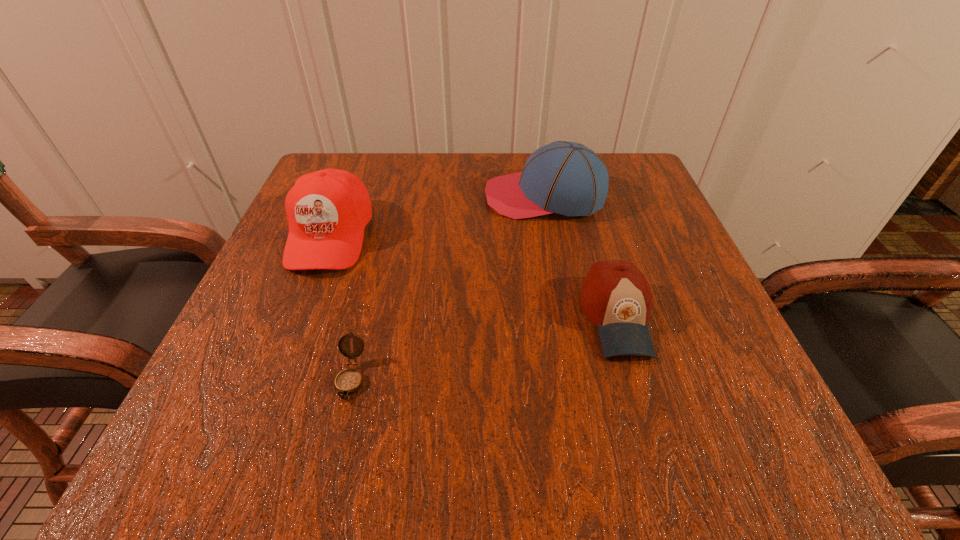
Where is `the leftmost baseball cap`? the leftmost baseball cap is located at coordinates (327, 210).

The width and height of the screenshot is (960, 540). What are the coordinates of `the third tallest object` in the screenshot? It's located at (615, 296).

Locate an element on the screen. The image size is (960, 540). the nearest baseball cap is located at coordinates (615, 296).

Find the location of a particular element. compass is located at coordinates (348, 381).

The width and height of the screenshot is (960, 540). In order to click on the third object from right to left in this screenshot , I will do `click(348, 381)`.

Where is `free space located 0.230m on the front panel of the leftmost object`? The image size is (960, 540). free space located 0.230m on the front panel of the leftmost object is located at coordinates (268, 394).

Locate an element on the screen. free location located 0.100m on the front-facing side of the shortest baseball cap is located at coordinates (649, 427).

This screenshot has width=960, height=540. In order to click on vacant space situated on the face of the third object from right to left in this screenshot , I will do `click(333, 451)`.

Image resolution: width=960 pixels, height=540 pixels. Identify the location of object located in the near edge section of the desktop. (348, 381).

Where is `object at the left edge`? This screenshot has height=540, width=960. object at the left edge is located at coordinates (327, 210).